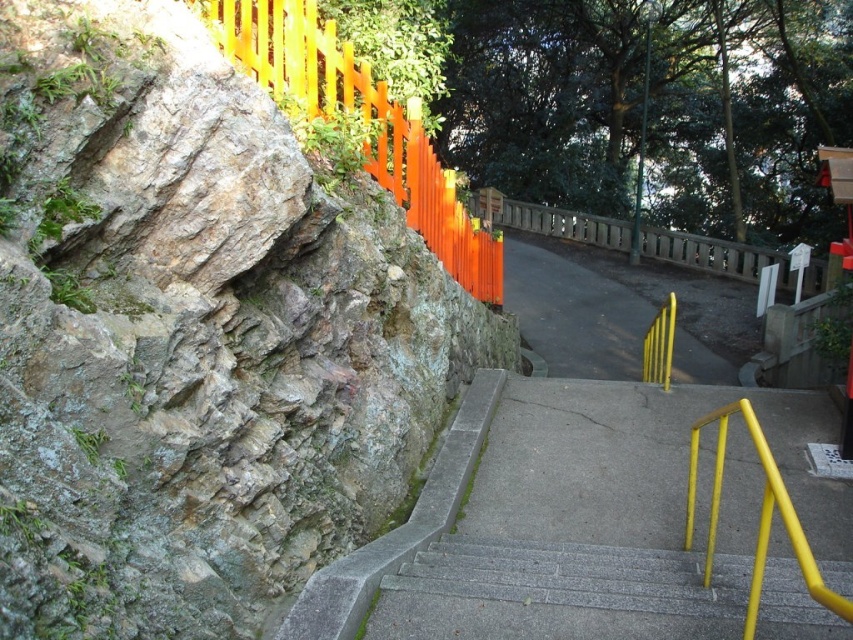
Question: Which object is positioned closest to the wooden at upper center?

Choices:
 (A) orange painted wood fence at upper left
 (B) gray concrete stairs at center

Answer: (B)

Question: Which point is closer to the camera?

Choices:
 (A) rocky cliff at left
 (B) gray concrete stairs at center
 (C) orange painted wood fence at upper left
 (D) wooden at upper center

Answer: (A)

Question: Does orange painted wood fence at upper left appear on the left side of wooden at upper center?

Choices:
 (A) no
 (B) yes

Answer: (B)

Question: Is rocky cliff at left in front of orange painted wood fence at upper left?

Choices:
 (A) no
 (B) yes

Answer: (B)

Question: Is gray concrete stairs at center smaller than orange painted wood fence at upper left?

Choices:
 (A) yes
 (B) no

Answer: (A)

Question: Which of the following is the farthest from the observer?

Choices:
 (A) (392, 586)
 (B) (0, 369)
 (C) (814, 276)
 (D) (314, 38)

Answer: (C)